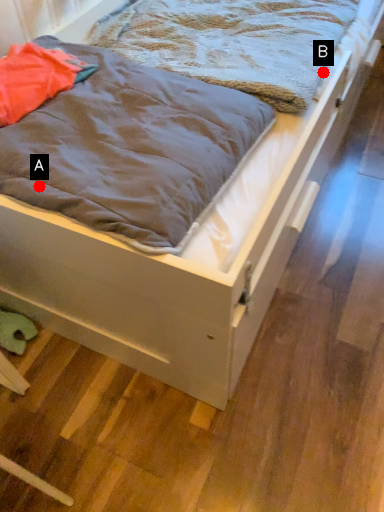
Question: Two points are circled on the image, labeled by A and B beside each circle. Which point appears farthest from the camera in this image?

Choices:
 (A) A is further
 (B) B is further

Answer: (B)